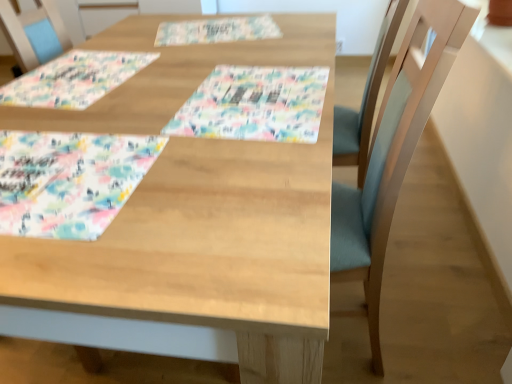
The width and height of the screenshot is (512, 384). Identify the location of vacant space in front of watercolor fabric placemat at center. (223, 190).